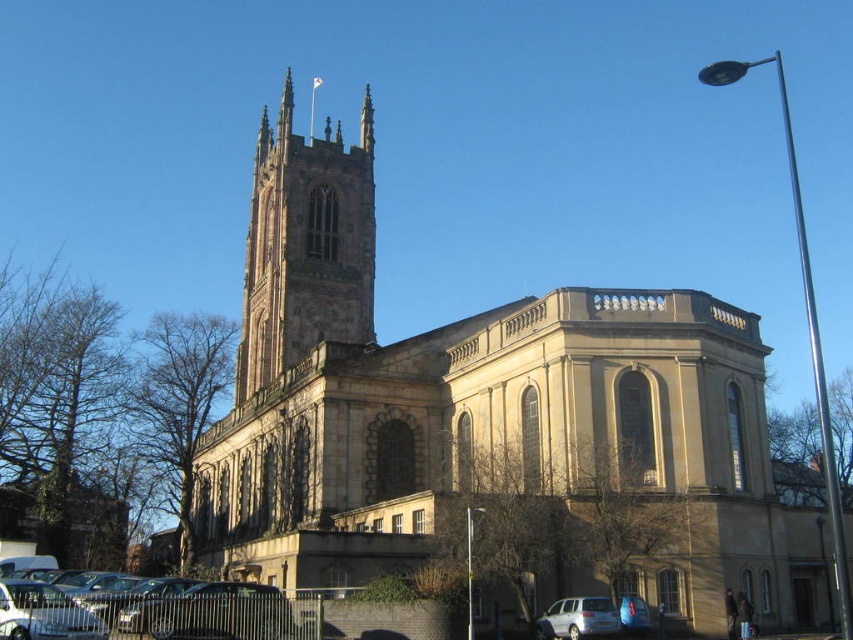
Question: Observing the image, what is the correct spatial positioning of brown stone church at center in reference to silver metallic car at lower left?

Choices:
 (A) left
 (B) right

Answer: (B)

Question: Considering the real-world distances, which object is farthest from the silver metallic car at lower right?

Choices:
 (A) blue matte car at lower center
 (B) brown stone tower at center-left
 (C) silver metallic car at lower left
 (D) brown stone church at center

Answer: (B)

Question: Which of the following is the closest to the observer?

Choices:
 (A) brown stone church at center
 (B) silver metallic car at lower left
 (C) silver metallic car at lower right
 (D) blue matte car at lower center

Answer: (A)

Question: Does brown stone tower at center-left have a greater width compared to silver metallic car at lower right?

Choices:
 (A) no
 (B) yes

Answer: (B)

Question: Does silver metallic car at lower left have a smaller size compared to silver metallic car at lower right?

Choices:
 (A) no
 (B) yes

Answer: (A)

Question: Which point is closer to the camera taking this photo?

Choices:
 (A) (643, 627)
 (B) (56, 612)
 (C) (339, 291)
 (D) (612, 604)

Answer: (B)